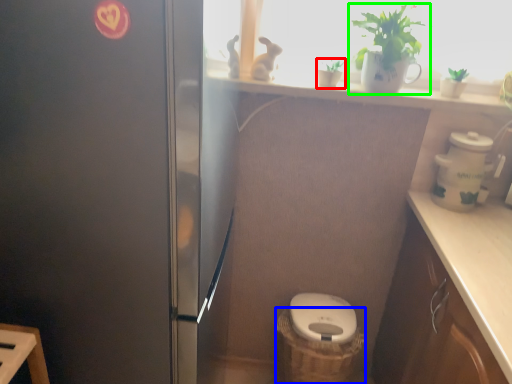
Question: Considering the real-world distances, which object is closest to houseplant (highlighted by a red box)? basket container (highlighted by a blue box) or houseplant (highlighted by a green box).

Choices:
 (A) basket container
 (B) houseplant

Answer: (B)